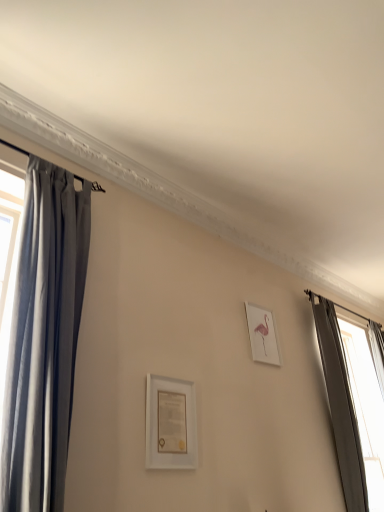
Question: Is pink paper at upper right, which ranks as the second picture frame in left-to-right order, next to dark gray fabric curtain at right, acting as the 1th curtain starting from the right, and touching it?

Choices:
 (A) yes
 (B) no

Answer: (B)

Question: Would you consider pink paper at upper right, the first picture frame in the right-to-left sequence, to be distant from dark gray fabric curtain at right, the first curtain positioned from the back?

Choices:
 (A) no
 (B) yes

Answer: (B)

Question: Considering the relative positions of pink paper at upper right, which ranks as the second picture frame in left-to-right order, and dark gray fabric curtain at right, the second curtain in the left-to-right sequence, in the image provided, is pink paper at upper right, which ranks as the second picture frame in left-to-right order, to the left of dark gray fabric curtain at right, the second curtain in the left-to-right sequence, from the viewer's perspective?

Choices:
 (A) yes
 (B) no

Answer: (A)

Question: Can you confirm if pink paper at upper right, the first picture frame in the right-to-left sequence, is wider than dark gray fabric curtain at right, acting as the 1th curtain starting from the right?

Choices:
 (A) yes
 (B) no

Answer: (B)

Question: Is pink paper at upper right, which is the first picture frame in back-to-front order, oriented towards dark gray fabric curtain at right, the second curtain viewed from the front?

Choices:
 (A) yes
 (B) no

Answer: (B)

Question: Does point click(374, 396) appear closer or farther from the camera than point click(158, 428)?

Choices:
 (A) farther
 (B) closer

Answer: (A)

Question: In terms of width, does dark gray fabric curtain at right, the first curtain positioned from the back, look wider or thinner when compared to white matte picture frame at center, which appears as the 1th picture frame when viewed from the left?

Choices:
 (A) wide
 (B) thin

Answer: (A)

Question: Is dark gray fabric curtain at right, the second curtain in the left-to-right sequence, to the left or to the right of white matte picture frame at center, the 2th picture frame when ordered from back to front, in the image?

Choices:
 (A) left
 (B) right

Answer: (B)

Question: From the image's perspective, relative to white matte picture frame at center, which appears as the 1th picture frame when viewed from the left, is dark gray fabric curtain at right, the first curtain positioned from the back, above or below?

Choices:
 (A) above
 (B) below

Answer: (B)

Question: Is white matte picture frame at center, the 2th picture frame when ordered from back to front, wider or thinner than pink paper at upper right, which is the first picture frame in back-to-front order?

Choices:
 (A) wide
 (B) thin

Answer: (A)

Question: Considering the positions of white matte picture frame at center, placed as the second picture frame when sorted from right to left, and pink paper at upper right, which is the first picture frame in back-to-front order, in the image, is white matte picture frame at center, placed as the second picture frame when sorted from right to left, bigger or smaller than pink paper at upper right, which is the first picture frame in back-to-front order,?

Choices:
 (A) big
 (B) small

Answer: (B)

Question: From a real-world perspective, is white matte picture frame at center, which appears as the 1th picture frame when viewed from the left, above or below pink paper at upper right, which is the first picture frame in back-to-front order?

Choices:
 (A) below
 (B) above

Answer: (A)

Question: From their relative heights in the image, would you say white matte picture frame at center, which appears as the 1th picture frame when viewed from the left, is taller or shorter than pink paper at upper right, which is the first picture frame in back-to-front order?

Choices:
 (A) short
 (B) tall

Answer: (A)

Question: From a real-world perspective, relative to dark gray fabric curtain at right, the first curtain positioned from the back, is white matte picture frame at center, which appears as the 1th picture frame when viewed from the left, vertically above or below?

Choices:
 (A) below
 (B) above

Answer: (A)

Question: Do you think white matte picture frame at center, placed as the second picture frame when sorted from right to left, is within dark gray fabric curtain at right, the first curtain positioned from the back, or outside of it?

Choices:
 (A) inside
 (B) outside

Answer: (B)